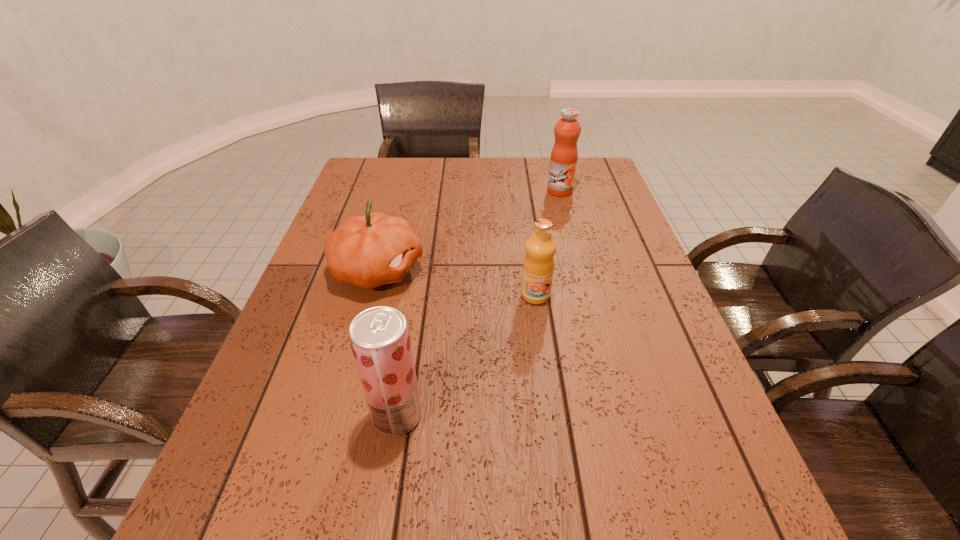
I want to click on vacant area that satisfies the following two spatial constraints: 1. on the front face of the pumpkin; 2. on the left side of the nearest fruit juice, so click(x=338, y=415).

The height and width of the screenshot is (540, 960). I want to click on free space that satisfies the following two spatial constraints: 1. on the front label of the rightmost fruit juice; 2. on the front face of the pumpkin, so click(581, 271).

Where is `vacant position in the image that satisfies the following two spatial constraints: 1. on the front label of the rightmost fruit juice; 2. on the front face of the pumpkin`? This screenshot has width=960, height=540. vacant position in the image that satisfies the following two spatial constraints: 1. on the front label of the rightmost fruit juice; 2. on the front face of the pumpkin is located at coordinates (581, 271).

I want to click on vacant region that satisfies the following two spatial constraints: 1. on the front face of the nearest object; 2. on the left side of the pumpkin, so click(338, 415).

Find the location of a particular element. vacant space that satisfies the following two spatial constraints: 1. on the front face of the pumpkin; 2. on the left side of the leftmost fruit juice is located at coordinates (338, 415).